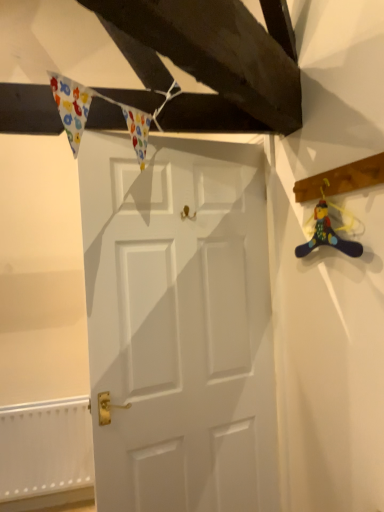
Find the location of a particular element. The width and height of the screenshot is (384, 512). blank space above white textured radiator at lower left (from a real-world perspective) is located at coordinates (49, 402).